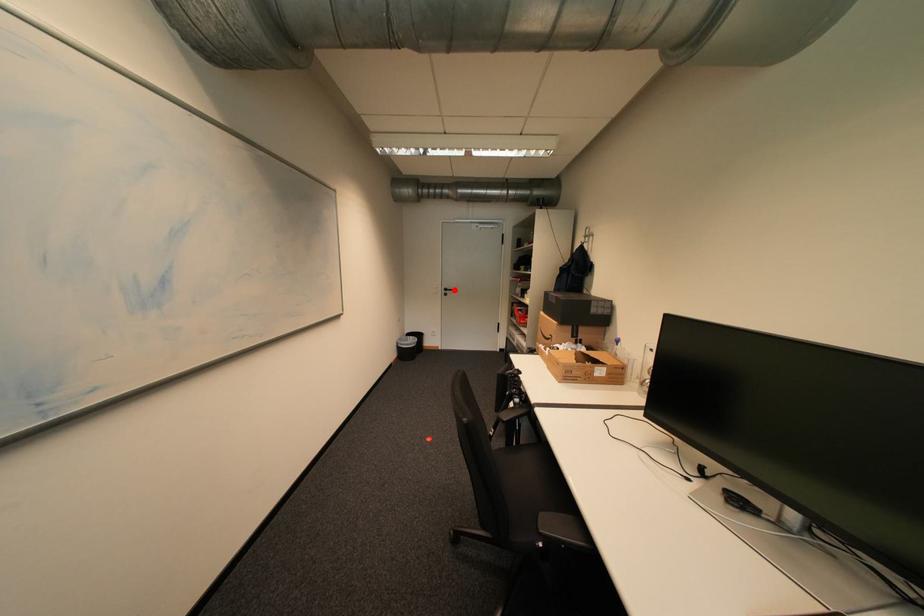
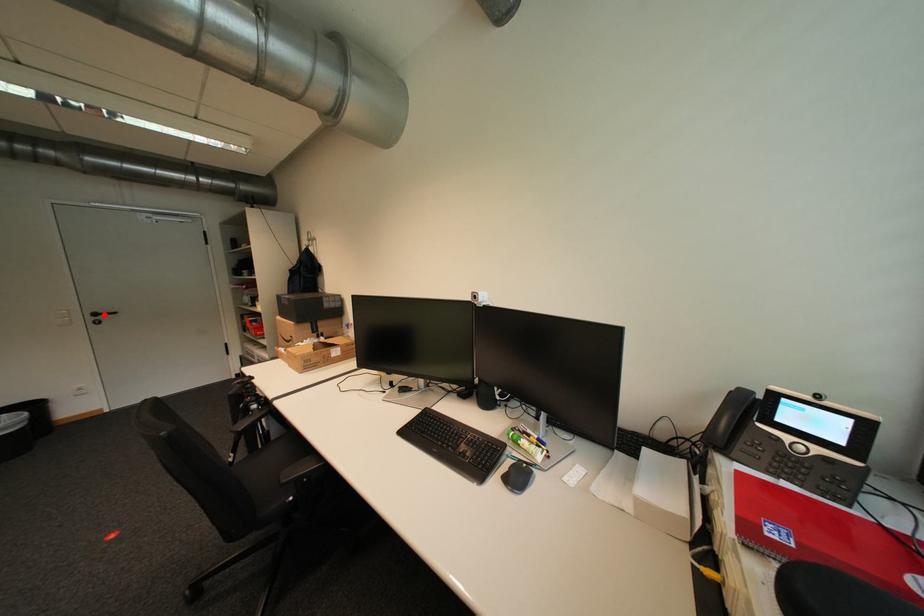
I am providing you with two images of the same scene from different viewpoints. A red point is marked on the first image and another point is marked on the second image. Does the point marked in image1 correspond to the same location as the one in image2?

Yes